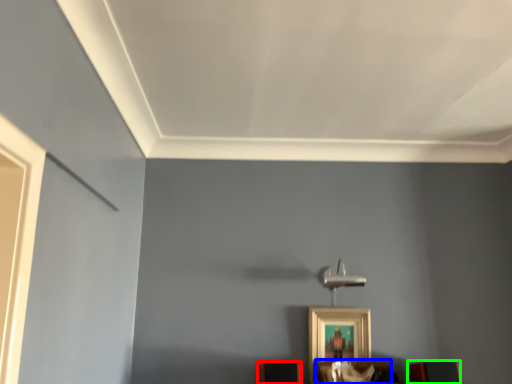
Question: Which object is the closest to the furniture (highlighted by a red box)? Choose among these: furniture (highlighted by a blue box) or furniture (highlighted by a green box).

Choices:
 (A) furniture
 (B) furniture

Answer: (A)